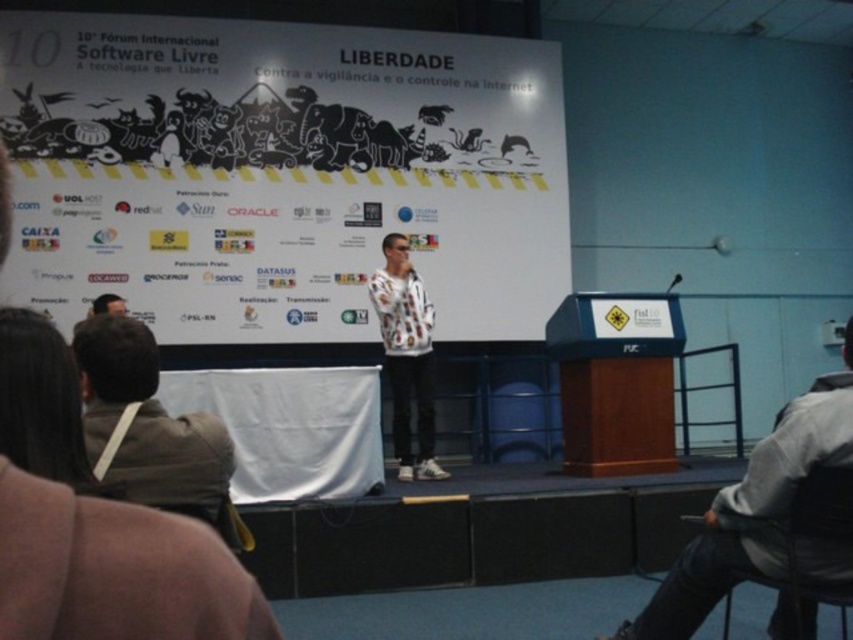
You are attending the conference and need to place a small plant that is 0.5 meters tall on the stage. The plant must be placed either on the white paper at center or the brown leather jacket at lower left. Which object can accommodate the plant based on height?

The white paper at center is taller than the brown leather jacket at lower left. Since the plant is 0.5 meters tall, it can be placed on the white paper at center as it provides sufficient height.

You are attending the 10th International Free Software Forum and notice two attendees wearing a brown leather jacket at lower left and a white printed sweater at center. Which attendee is sitting to the left of the other?

The brown leather jacket at lower left is positioned on the left side of white printed sweater at center, so the attendee wearing the brown leather jacket at lower left is sitting to the left of the one wearing the white printed sweater at center.